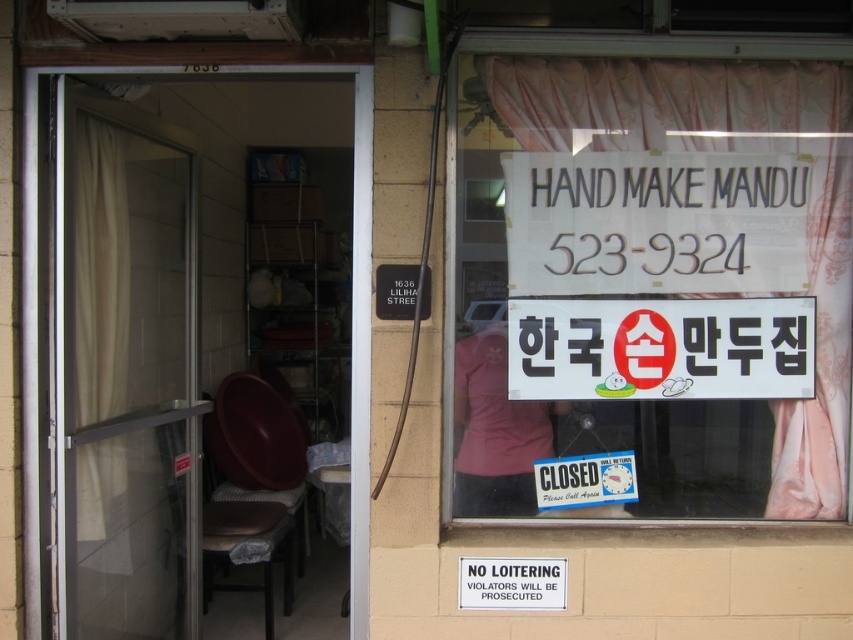
Looking at this image, you are a delivery person holding a package that needs to be handed to the store. The camera is mounted on the wall 7.79 feet away from the transparent glass door at left. To avoid being recorded, you decide to stand behind an object. Which object can you use to block the camera view?

The transparent glass door at left is 7.79 feet away from the camera. Since the distance matches exactly, you can position yourself behind the transparent glass door at left to block the camera view.